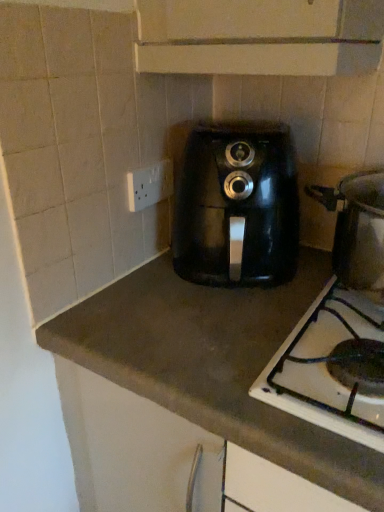
The width and height of the screenshot is (384, 512). Find the location of `free space above black matte gas stove at lower right (from a real-world perspective)`. free space above black matte gas stove at lower right (from a real-world perspective) is located at coordinates (327, 348).